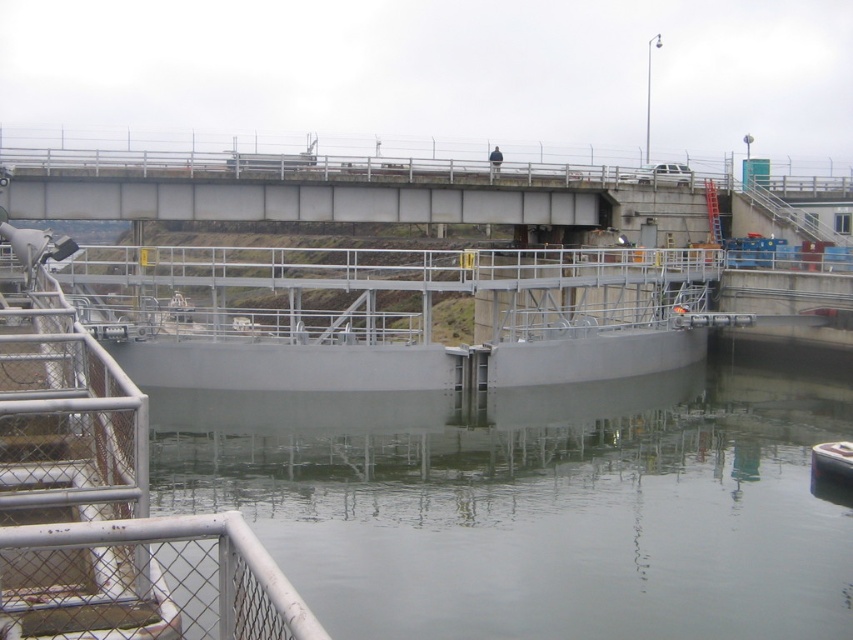
You are a boat operator who needs to navigate the metallic gray boat at lower right through the gray metallic water at center. Based on the scene, can the boat pass through the water area safely?

The gray metallic water at center is much taller than the metallic gray boat at lower right, so the boat can pass through safely as there is sufficient height clearance.

You are a tour guide explaining the lock system to visitors. You point to the gray metallic water at center and the metallic gray boat at lower right. Which object is nearer to the visitors standing on the platform?

The gray metallic water at center is closer to the visitors than the metallic gray boat at lower right.